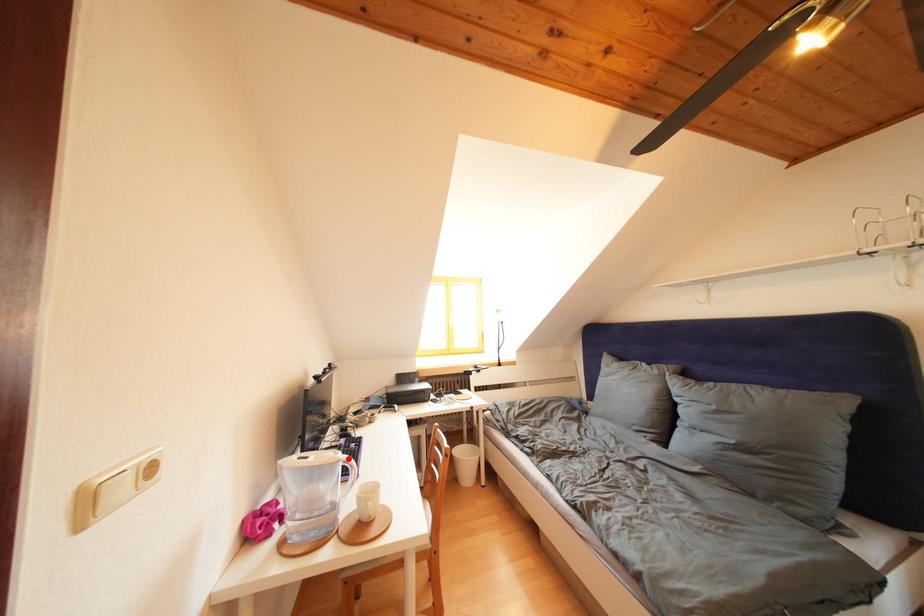
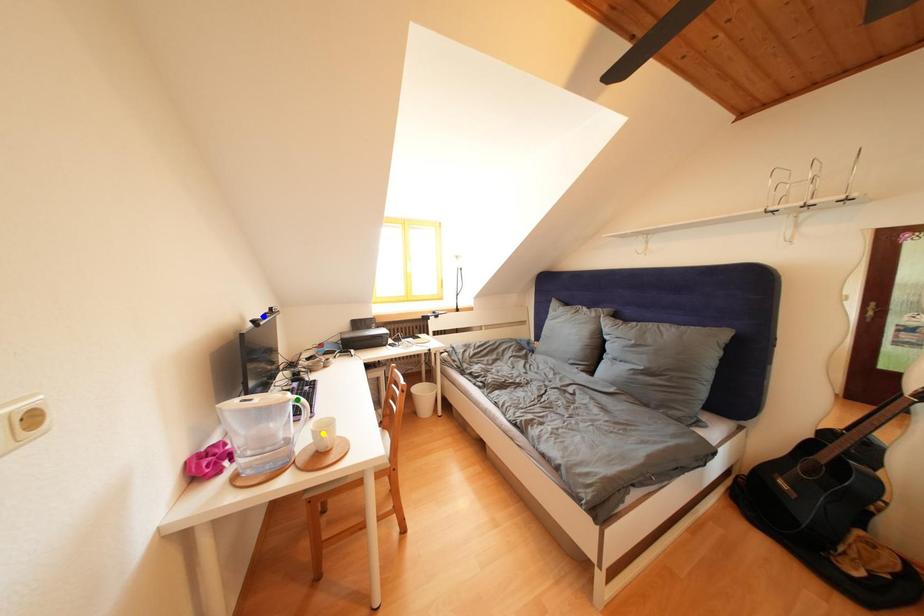
Question: I am providing you with two images of the same scene from different viewpoints. A red point is marked on the first image. You are given multiple points on the second image. Which mark in image 2 goes with the point in image 1?

Choices:
 (A) yellow point
 (B) blue point
 (C) green point

Answer: (C)